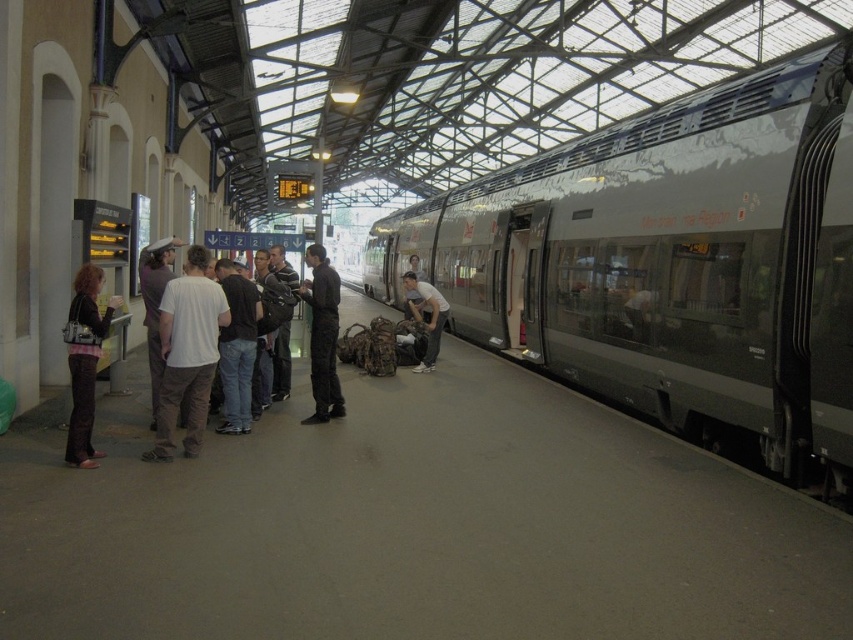
Question: Does white cotton shirt at center appear on the left side of dark gray jeans at center?

Choices:
 (A) yes
 (B) no

Answer: (A)

Question: Which object appears farthest from the camera in this image?

Choices:
 (A) matte black jacket at left
 (B) white cotton shirt at center

Answer: (B)

Question: Can you confirm if silver metallic train at center is thinner than dark gray pants at center?

Choices:
 (A) no
 (B) yes

Answer: (A)

Question: Based on their relative distances, which object is nearer to the dark gray jeans at center?

Choices:
 (A) white cotton shirt at center
 (B) matte white shirt at center
 (C) matte black jacket at left
 (D) silver metallic train at center

Answer: (A)

Question: From the image, what is the correct spatial relationship of dark gray jeans at center in relation to matte white shirt at center?

Choices:
 (A) below
 (B) above

Answer: (A)

Question: Which point is farther to the camera?

Choices:
 (A) dark gray jeans at center
 (B) matte white shirt at center

Answer: (B)